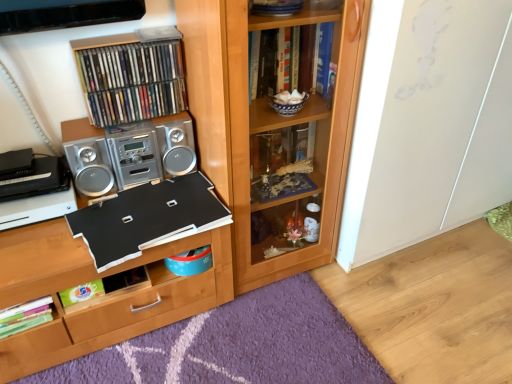
Question: Is metallic silver stereo at upper left, which appears as the 2th book when ordered from the bottom, touching metallic cd case at upper left, which appears as the 3th book when ordered from the bottom?

Choices:
 (A) no
 (B) yes

Answer: (B)

Question: Can you confirm if metallic silver stereo at upper left, the second book viewed from the top, is positioned to the left of metallic cd case at upper left, which appears as the 3th book when ordered from the bottom?

Choices:
 (A) no
 (B) yes

Answer: (B)

Question: Can you confirm if metallic silver stereo at upper left, which appears as the 2th book when ordered from the bottom, is smaller than metallic cd case at upper left, which appears as the 3th book when ordered from the bottom?

Choices:
 (A) no
 (B) yes

Answer: (B)

Question: Is metallic silver stereo at upper left, which appears as the 2th book when ordered from the bottom, oriented away from metallic cd case at upper left, arranged as the 1th book when viewed from the top?

Choices:
 (A) yes
 (B) no

Answer: (B)

Question: Can we say metallic silver stereo at upper left, the second book viewed from the top, lies outside metallic cd case at upper left, arranged as the 1th book when viewed from the top?

Choices:
 (A) no
 (B) yes

Answer: (B)

Question: From a real-world perspective, is metallic silver stereo at upper left, the second book viewed from the top, positioned under metallic cd case at upper left, arranged as the 1th book when viewed from the top, based on gravity?

Choices:
 (A) no
 (B) yes

Answer: (B)

Question: Is black matte board at center at the right side of black matte board at center, which is the third book in top-to-bottom order?

Choices:
 (A) yes
 (B) no

Answer: (B)

Question: Is the depth of black matte board at center less than that of black matte board at center, which is counted as the 1th book, starting from the bottom?

Choices:
 (A) yes
 (B) no

Answer: (A)

Question: From a real-world perspective, is black matte board at center physically below black matte board at center, which is the third book in top-to-bottom order?

Choices:
 (A) yes
 (B) no

Answer: (A)

Question: Considering the relative sizes of black matte board at center and black matte board at center, which is the third book in top-to-bottom order, in the image provided, is black matte board at center smaller than black matte board at center, which is the third book in top-to-bottom order,?

Choices:
 (A) yes
 (B) no

Answer: (B)

Question: From the image's perspective, is black matte board at center on black matte board at center, which is counted as the 1th book, starting from the bottom?

Choices:
 (A) yes
 (B) no

Answer: (B)

Question: Is black matte board at center thinner than black matte board at center, which is counted as the 1th book, starting from the bottom?

Choices:
 (A) yes
 (B) no

Answer: (B)

Question: From a real-world perspective, is black matte board at center, which is the third book in top-to-bottom order, on top of black matte board at center?

Choices:
 (A) yes
 (B) no

Answer: (A)